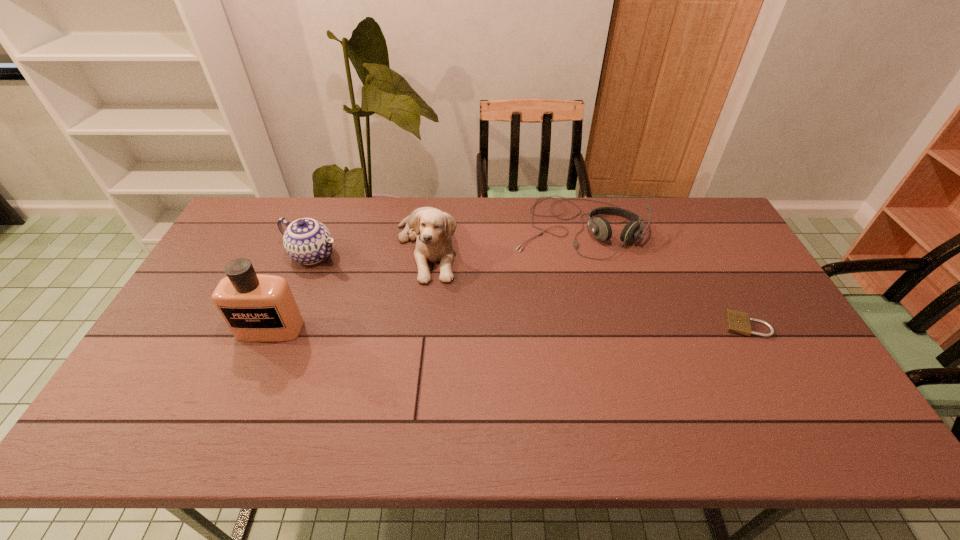
Find the location of a particular element. The width and height of the screenshot is (960, 540). perfume is located at coordinates (256, 307).

Identify the location of padlock. Image resolution: width=960 pixels, height=540 pixels. (738, 322).

Where is `the rightmost object`? The width and height of the screenshot is (960, 540). the rightmost object is located at coordinates (738, 322).

I want to click on the fourth shortest object, so click(x=433, y=229).

Find the location of a particular element. the third object from left to right is located at coordinates (433, 229).

What are the coordinates of `the second shortest object` in the screenshot? It's located at (600, 227).

Where is `headset`? Image resolution: width=960 pixels, height=540 pixels. headset is located at coordinates (600, 227).

You are a GUI agent. You are given a task and a screenshot of the screen. Output one action in this format:
    pyautogui.click(x=<x>, y=<y>)
    Task: Click on the third tallest object
    The width and height of the screenshot is (960, 540).
    Given the screenshot: What is the action you would take?
    pyautogui.click(x=307, y=241)

Where is `vacant space located on the front label of the tallest object`? This screenshot has height=540, width=960. vacant space located on the front label of the tallest object is located at coordinates (239, 403).

Locate an element on the screen. The height and width of the screenshot is (540, 960). free space located 0.100m on the back of the rightmost object is located at coordinates (726, 287).